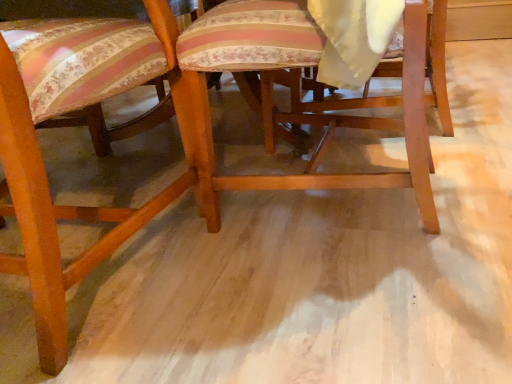
Find the location of a particular element. This screenshot has height=384, width=512. wooden chair at center, the second chair when ordered from right to left is located at coordinates (73, 125).

Describe the element at coordinates (73, 125) in the screenshot. I see `wooden chair at center, the second chair when ordered from right to left` at that location.

How much space does wooden chair at center, marked as the first chair in a right-to-left arrangement, occupy horizontally?

wooden chair at center, marked as the first chair in a right-to-left arrangement, is 21.91 inches wide.

Locate an element on the screen. The height and width of the screenshot is (384, 512). wooden chair at center, the second chair positioned from the left is located at coordinates (297, 107).

Describe the element at coordinates (297, 107) in the screenshot. I see `wooden chair at center, marked as the first chair in a right-to-left arrangement` at that location.

At what (x,y) coordinates should I click in order to perform the action: click on wooden chair at center, arranged as the first chair when viewed from the left. Please return your answer as a coordinate pair (x, y). Looking at the image, I should click on (73, 125).

Considering the positions of objects wooden chair at center, marked as the first chair in a right-to-left arrangement, and wooden chair at center, arranged as the first chair when viewed from the left, in the image provided, who is more to the left, wooden chair at center, marked as the first chair in a right-to-left arrangement, or wooden chair at center, arranged as the first chair when viewed from the left,?

Positioned to the left is wooden chair at center, arranged as the first chair when viewed from the left.

Is wooden chair at center, marked as the first chair in a right-to-left arrangement, further to the viewer compared to wooden chair at center, arranged as the first chair when viewed from the left?

Yes, wooden chair at center, marked as the first chair in a right-to-left arrangement, is further from the viewer.

Does point (270, 117) come behind point (53, 206)?

Yes.

From the image's perspective, is wooden chair at center, the second chair positioned from the left, under wooden chair at center, arranged as the first chair when viewed from the left?

No.

From a real-world perspective, is wooden chair at center, marked as the first chair in a right-to-left arrangement, positioned over wooden chair at center, the second chair when ordered from right to left, based on gravity?

Actually, wooden chair at center, marked as the first chair in a right-to-left arrangement, is physically below wooden chair at center, the second chair when ordered from right to left, in the real world.

From the picture: Between wooden chair at center, marked as the first chair in a right-to-left arrangement, and wooden chair at center, arranged as the first chair when viewed from the left, which one has larger width?

wooden chair at center, arranged as the first chair when viewed from the left.

Which of these two, wooden chair at center, the second chair positioned from the left, or wooden chair at center, arranged as the first chair when viewed from the left, stands shorter?

With less height is wooden chair at center, the second chair positioned from the left.

Which of these two, wooden chair at center, marked as the first chair in a right-to-left arrangement, or wooden chair at center, the second chair when ordered from right to left, is smaller?

Smaller between the two is wooden chair at center, marked as the first chair in a right-to-left arrangement.

Is wooden chair at center, the second chair when ordered from right to left, completely or partially inside wooden chair at center, marked as the first chair in a right-to-left arrangement?

That's incorrect, wooden chair at center, the second chair when ordered from right to left, is not inside wooden chair at center, marked as the first chair in a right-to-left arrangement.

Is the surface of wooden chair at center, marked as the first chair in a right-to-left arrangement, in direct contact with wooden chair at center, the second chair when ordered from right to left?

No, wooden chair at center, marked as the first chair in a right-to-left arrangement, is not beside wooden chair at center, the second chair when ordered from right to left.

Is wooden chair at center, the second chair positioned from the left, oriented away from wooden chair at center, the second chair when ordered from right to left?

No, wooden chair at center, the second chair positioned from the left, is not facing away from wooden chair at center, the second chair when ordered from right to left.

How different are the orientations of wooden chair at center, the second chair positioned from the left, and wooden chair at center, arranged as the first chair when viewed from the left, in degrees?

89.2 degrees.

How much distance is there between wooden chair at center, the second chair positioned from the left, and wooden chair at center, the second chair when ordered from right to left?

The distance of wooden chair at center, the second chair positioned from the left, from wooden chair at center, the second chair when ordered from right to left, is 11.25 inches.

The width and height of the screenshot is (512, 384). I want to click on chair on the right of wooden chair at center, the second chair when ordered from right to left, so click(297, 107).

Between wooden chair at center, arranged as the first chair when viewed from the left, and wooden chair at center, the second chair positioned from the left, which one appears on the left side from the viewer's perspective?

Positioned to the left is wooden chair at center, arranged as the first chair when viewed from the left.

Considering the positions of objects wooden chair at center, the second chair when ordered from right to left, and wooden chair at center, the second chair positioned from the left, in the image provided, who is behind, wooden chair at center, the second chair when ordered from right to left, or wooden chair at center, the second chair positioned from the left,?

wooden chair at center, the second chair positioned from the left, is more distant.

Considering the positions of point (66, 284) and point (339, 175), is point (66, 284) closer or farther from the camera than point (339, 175)?

Point (66, 284) appears to be closer to the viewer than point (339, 175).

From the image's perspective, is wooden chair at center, the second chair when ordered from right to left, on top of wooden chair at center, marked as the first chair in a right-to-left arrangement?

No, from the image's perspective, wooden chair at center, the second chair when ordered from right to left, is not above wooden chair at center, marked as the first chair in a right-to-left arrangement.

From a real-world perspective, is wooden chair at center, the second chair when ordered from right to left, positioned above or below wooden chair at center, marked as the first chair in a right-to-left arrangement?

In terms of real-world spatial position, wooden chair at center, the second chair when ordered from right to left, is above wooden chair at center, marked as the first chair in a right-to-left arrangement.

Consider the image. In terms of width, does wooden chair at center, arranged as the first chair when viewed from the left, look wider or thinner when compared to wooden chair at center, the second chair positioned from the left?

Clearly, wooden chair at center, arranged as the first chair when viewed from the left, has more width compared to wooden chair at center, the second chair positioned from the left.

From the picture: Considering the relative sizes of wooden chair at center, arranged as the first chair when viewed from the left, and wooden chair at center, the second chair positioned from the left, in the image provided, is wooden chair at center, arranged as the first chair when viewed from the left, taller than wooden chair at center, the second chair positioned from the left,?

Correct, wooden chair at center, arranged as the first chair when viewed from the left, is much taller as wooden chair at center, the second chair positioned from the left.

Considering the relative sizes of wooden chair at center, the second chair when ordered from right to left, and wooden chair at center, marked as the first chair in a right-to-left arrangement, in the image provided, is wooden chair at center, the second chair when ordered from right to left, bigger than wooden chair at center, marked as the first chair in a right-to-left arrangement,?

Yes.

Is wooden chair at center, marked as the first chair in a right-to-left arrangement, located within wooden chair at center, the second chair when ordered from right to left?

Actually, wooden chair at center, marked as the first chair in a right-to-left arrangement, is outside wooden chair at center, the second chair when ordered from right to left.

Would you say wooden chair at center, arranged as the first chair when viewed from the left, is a long distance from wooden chair at center, marked as the first chair in a right-to-left arrangement?

wooden chair at center, arranged as the first chair when viewed from the left, is near wooden chair at center, marked as the first chair in a right-to-left arrangement, not far away.

Is wooden chair at center, arranged as the first chair when viewed from the left, turned away from wooden chair at center, the second chair positioned from the left?

No, wooden chair at center, arranged as the first chair when viewed from the left,'s orientation is not away from wooden chair at center, the second chair positioned from the left.

How distant is wooden chair at center, the second chair when ordered from right to left, from wooden chair at center, marked as the first chair in a right-to-left arrangement?

11.25 inches.

I want to click on chair lying below the wooden chair at center, the second chair positioned from the left (from the image's perspective), so click(x=73, y=125).

Image resolution: width=512 pixels, height=384 pixels. What are the coordinates of `chair on the left of wooden chair at center, marked as the first chair in a right-to-left arrangement` in the screenshot? It's located at (73, 125).

Locate an element on the screen. Image resolution: width=512 pixels, height=384 pixels. chair below the wooden chair at center, marked as the first chair in a right-to-left arrangement (from the image's perspective) is located at coordinates (73, 125).